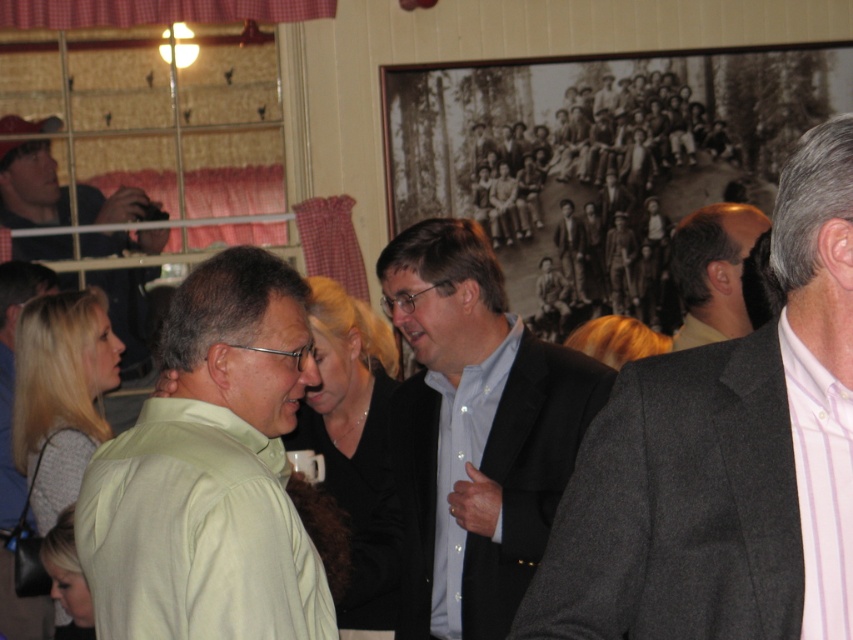
Question: Does gray wool suit at right have a lesser width compared to green matte shirt at center?

Choices:
 (A) yes
 (B) no

Answer: (A)

Question: Which point is closer to the camera?

Choices:
 (A) gray wool suit at right
 (B) matte black suit at center
 (C) brown hair at center
 (D) matte black camera at left

Answer: (A)

Question: Which point is closer to the camera?

Choices:
 (A) gray wool suit at right
 (B) green matte shirt at center

Answer: (A)

Question: Among these objects, which one is farthest from the camera?

Choices:
 (A) green matte shirt at center
 (B) brown hair at center
 (C) gray wool suit at right

Answer: (B)

Question: Is gray wool suit at right thinner than green matte shirt at center?

Choices:
 (A) yes
 (B) no

Answer: (A)

Question: Is gray wool suit at right to the left of brown hair at center from the viewer's perspective?

Choices:
 (A) yes
 (B) no

Answer: (A)